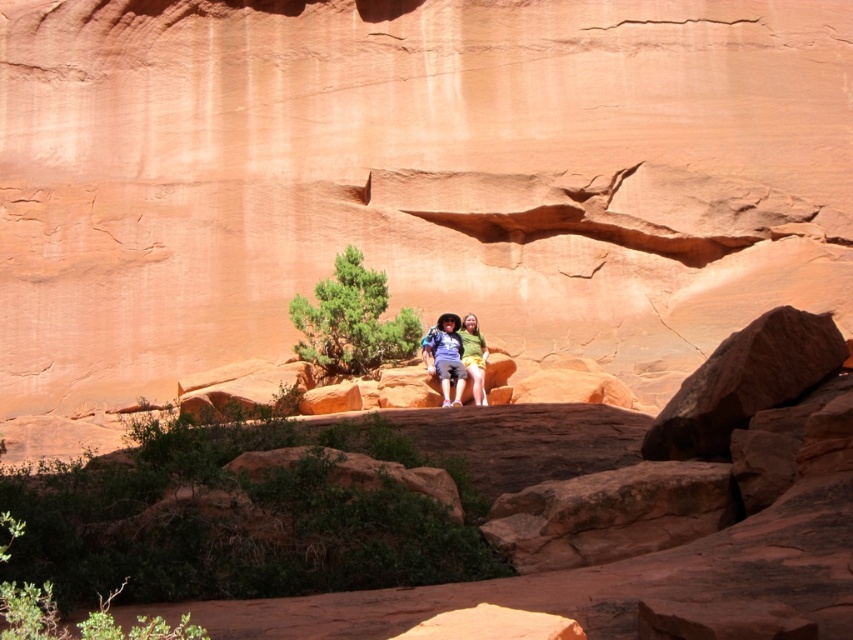
Question: Does matte blue shorts at center have a smaller size compared to matte green shorts at center?

Choices:
 (A) yes
 (B) no

Answer: (A)

Question: Which of the following is the farthest from the observer?

Choices:
 (A) matte green shorts at center
 (B) matte blue shorts at center

Answer: (B)

Question: Which of the following is the closest to the observer?

Choices:
 (A) matte green shorts at center
 (B) matte blue shorts at center

Answer: (A)

Question: Does matte blue shorts at center have a smaller size compared to matte green shorts at center?

Choices:
 (A) yes
 (B) no

Answer: (A)

Question: Does matte blue shorts at center have a larger size compared to matte green shorts at center?

Choices:
 (A) no
 (B) yes

Answer: (A)